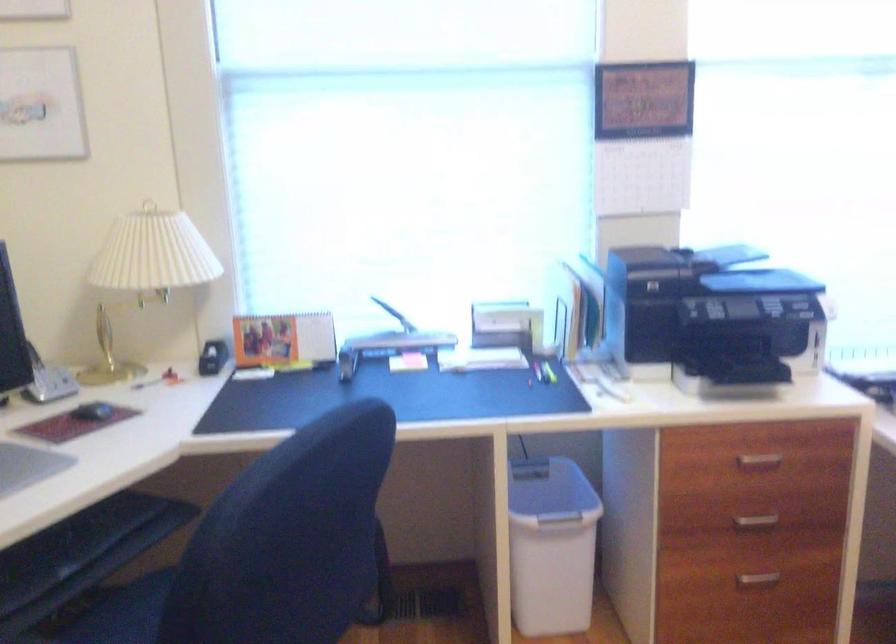
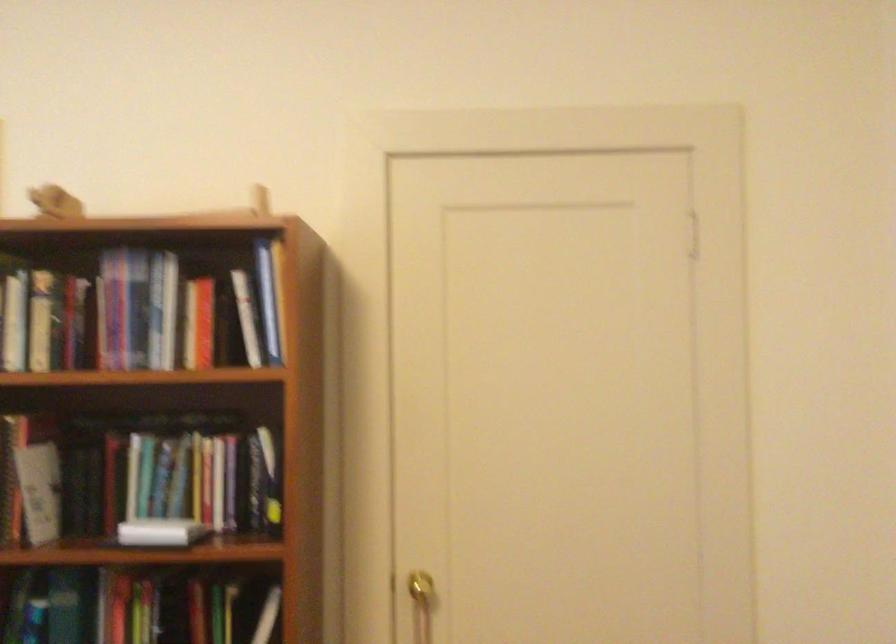
Question: The camera is either moving clockwise (left) or counter-clockwise (right) around the object. The first image is from the beginning of the video and the second image is from the end. Is the camera moving left or right when shooting the video?

Choices:
 (A) Left
 (B) Right

Answer: (A)